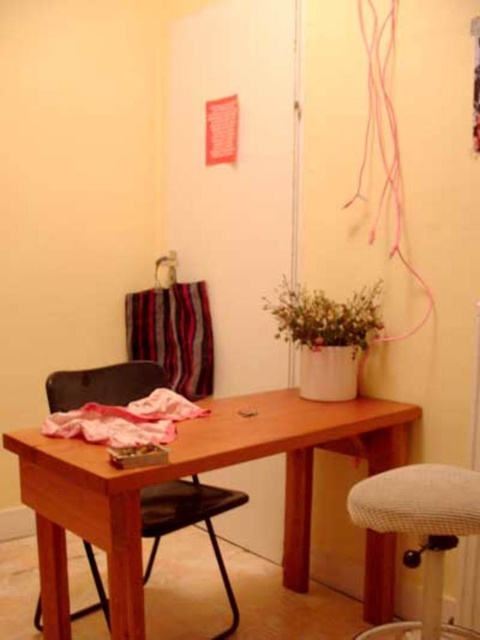
Question: Which point is farther to the camera?

Choices:
 (A) wooden table at center
 (B) black plastic chair at center

Answer: (B)

Question: Does white textured bar stool at lower right appear on the left side of black plastic chair at center?

Choices:
 (A) no
 (B) yes

Answer: (A)

Question: Based on their relative distances, which object is farther from the black plastic chair at center?

Choices:
 (A) wooden table at center
 (B) white textured bar stool at lower right

Answer: (B)

Question: Considering the relative positions of wooden table at center and white textured bar stool at lower right in the image provided, where is wooden table at center located with respect to white textured bar stool at lower right?

Choices:
 (A) left
 (B) right

Answer: (A)

Question: Is wooden table at center wider than white textured bar stool at lower right?

Choices:
 (A) no
 (B) yes

Answer: (B)

Question: Among these points, which one is farthest from the camera?

Choices:
 (A) (210, 516)
 (B) (382, 596)

Answer: (B)